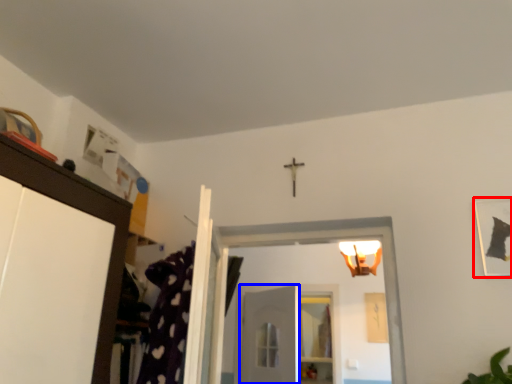
Question: Which object is closer to the camera taking this photo, picture frame (highlighted by a red box) or door (highlighted by a blue box)?

Choices:
 (A) picture frame
 (B) door

Answer: (A)